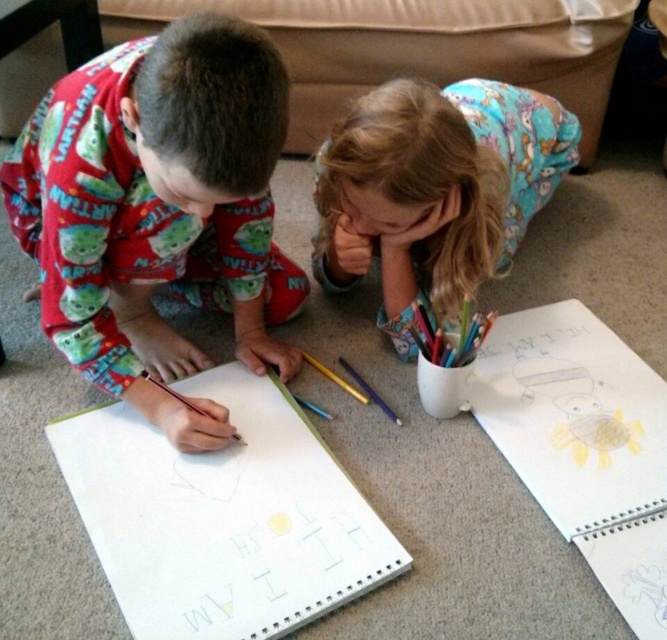
You are a parent trying to ensure your children are spaced safely while they draw. The children are wearing the fluffy blue pajamas at center and the red pajamas with green aliens. How far apart are the two children?

The fluffy blue pajamas at center and the red pajamas with green aliens are 3.33 feet apart.

You are a child trying to reach the matte yellow crayon at center from the fluffy blue pajamas at center. Can you easily grab it without moving your body?

The fluffy blue pajamas at center is closer to the viewer than the matte yellow crayon at center, so you would need to stretch or move slightly to reach it.

From the picture: You are a parent looking at the image of your children drawing. Where is the red cotton pajamas at left located in the image?

The red cotton pajamas at left are located at the point (157, 211) in the image.